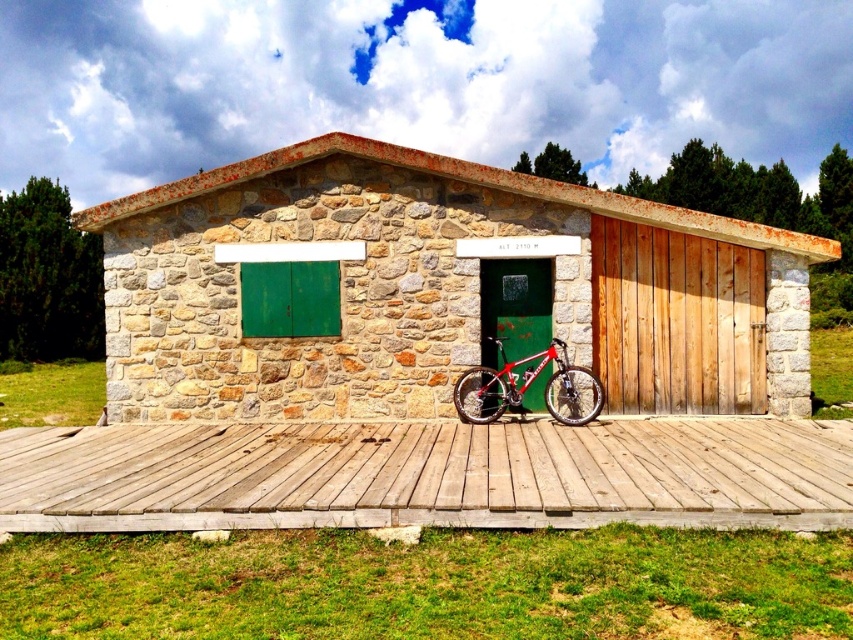
You are planning to place a shiny metallic bicycle at center next to the stone textured hut at center. Given their sizes, which one should be placed first to ensure they both fit in the space?

The stone textured hut at center is wider than the shiny metallic bicycle at center. Therefore, place the stone textured hut at center first to accommodate its larger size, then position the shiny metallic bicycle at center alongside it.

You are standing in front of the rustic stone building and want to place a shiny metallic bicycle at center. Given that the stone textured hut at center is above the bicycle, where should you position the bicycle relative to the building?

The stone textured hut at center is above the shiny metallic bicycle at center, so the bicycle should be placed below the hut, likely on the ground in front of the building.